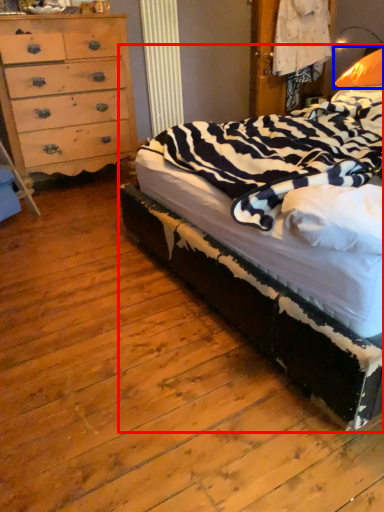
Question: Which of the following is the farthest to the observer, bed (highlighted by a red box) or pillow (highlighted by a blue box)?

Choices:
 (A) bed
 (B) pillow

Answer: (B)